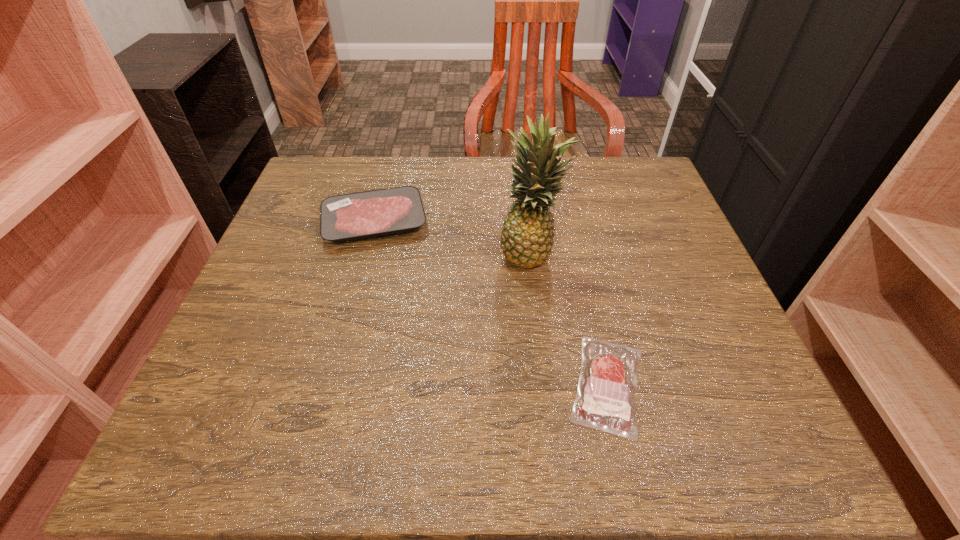
You are a GUI agent. You are given a task and a screenshot of the screen. Output one action in this format:
    pyautogui.click(x=<x>, y=<y>)
    Task: Click on the object at the left edge
    
    Given the screenshot: What is the action you would take?
    pyautogui.click(x=348, y=217)

I want to click on object positioned at the far left corner, so click(x=348, y=217).

Locate an element on the screen. The image size is (960, 540). vacant space at the far edge of the desktop is located at coordinates (402, 166).

Locate an element on the screen. This screenshot has height=540, width=960. free space at the left edge of the desktop is located at coordinates (293, 226).

The image size is (960, 540). What are the coordinates of `free space at the right edge` in the screenshot? It's located at (636, 249).

The image size is (960, 540). Identify the location of vacant area at the far left corner. (341, 182).

Locate an element on the screen. free region at the near left corner is located at coordinates (267, 443).

The width and height of the screenshot is (960, 540). I want to click on free space at the far right corner of the desktop, so click(x=620, y=185).

Where is `vacant region at the near right corner of the desktop`? The width and height of the screenshot is (960, 540). vacant region at the near right corner of the desktop is located at coordinates (680, 448).

Image resolution: width=960 pixels, height=540 pixels. I want to click on blank region between the farther steak and the tallest object, so click(x=453, y=238).